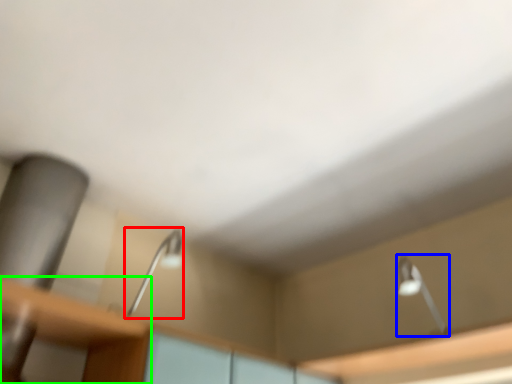
Question: Which is nearer to the lamp (highlighted by a red box)? lamp (highlighted by a blue box) or table (highlighted by a green box).

Choices:
 (A) lamp
 (B) table

Answer: (B)